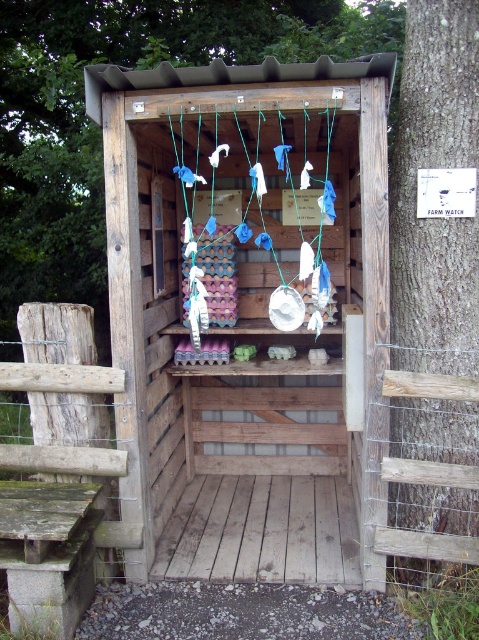
Looking at this image, is wooden hut at center wider than smooth bark tree at right?

Correct, the width of wooden hut at center exceeds that of smooth bark tree at right.

Does wooden hut at center have a lesser height compared to smooth bark tree at right?

Correct, wooden hut at center is not as tall as smooth bark tree at right.

Which is behind, point (167, 417) or point (453, 148)?

Positioned behind is point (167, 417).

Identify the location of wooden hut at center. This screenshot has width=479, height=640. (250, 316).